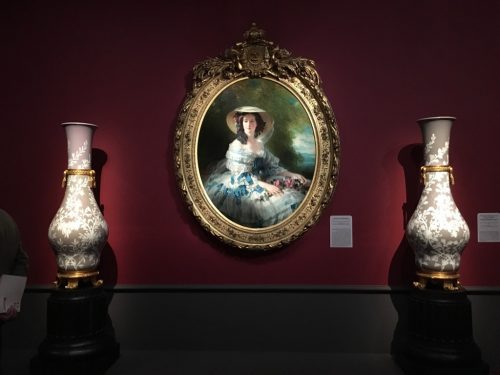
What are the coordinates of `painting` in the screenshot? It's located at (288, 135).